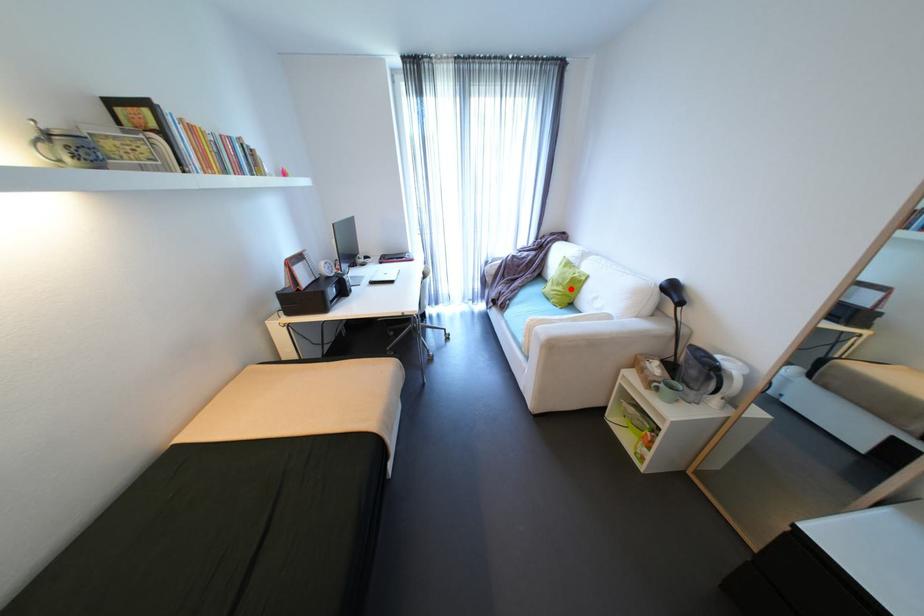
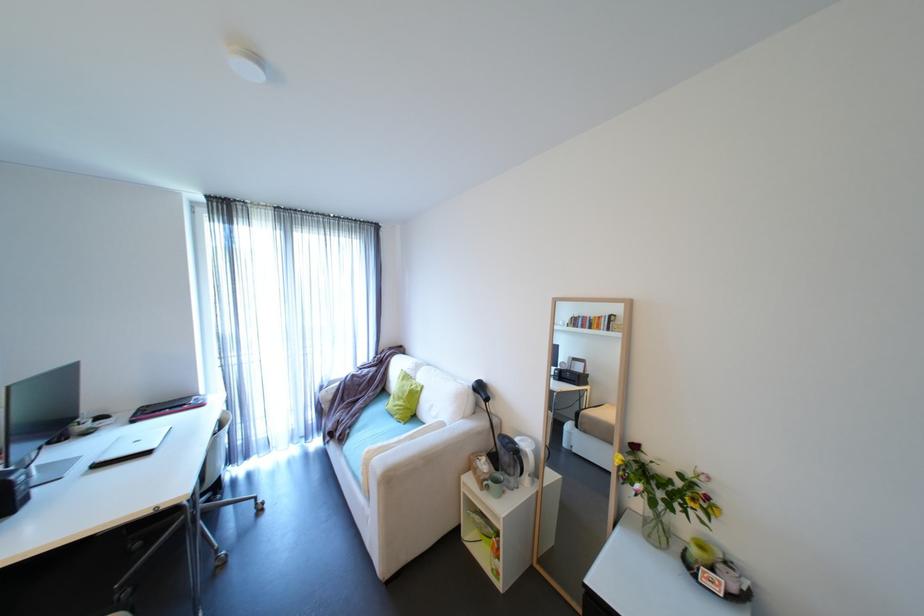
Question: I am providing you with two images of the same scene from different viewpoints. Image1 has a red point marked. In image2, the corresponding 3D location appears at what relative position? Reply with the corresponding letter.

Choices:
 (A) Closer
 (B) Farther

Answer: (B)